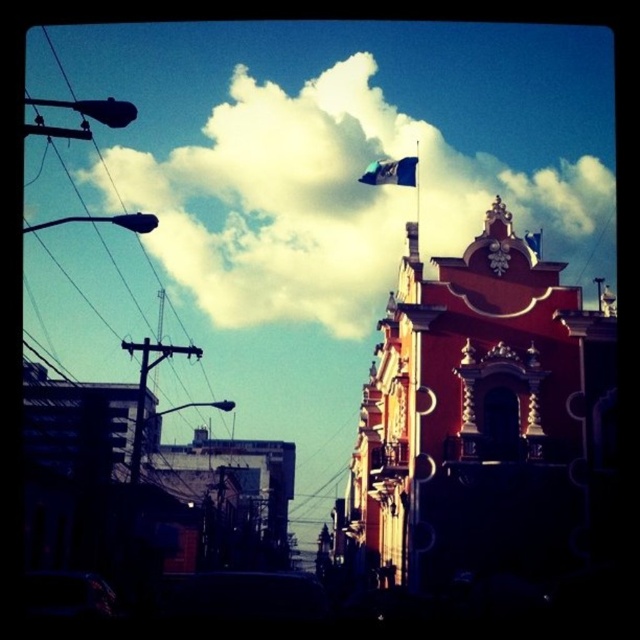
You are standing on the street looking up at the red building with the arched window. There is a point marked at coordinate (x=337, y=198). What object is this point located on?

The point at coordinate (x=337, y=198) is located on the white fluffy cloud at upper center.

You are standing in the street scene looking up at the red building. There is a point marked at coordinates (138, 404). What object does this point correspond to?

The point at coordinates (138, 404) corresponds to the metallic pole at left.

You are standing at the base of the red building and want to take a photo of both the point at coordinates point (304, 109) and point (371, 177). Which point should you focus on first to ensure both are in frame?

Since point (304, 109) is behind point (371, 177), you should focus on point (371, 177) first to ensure both are in frame.